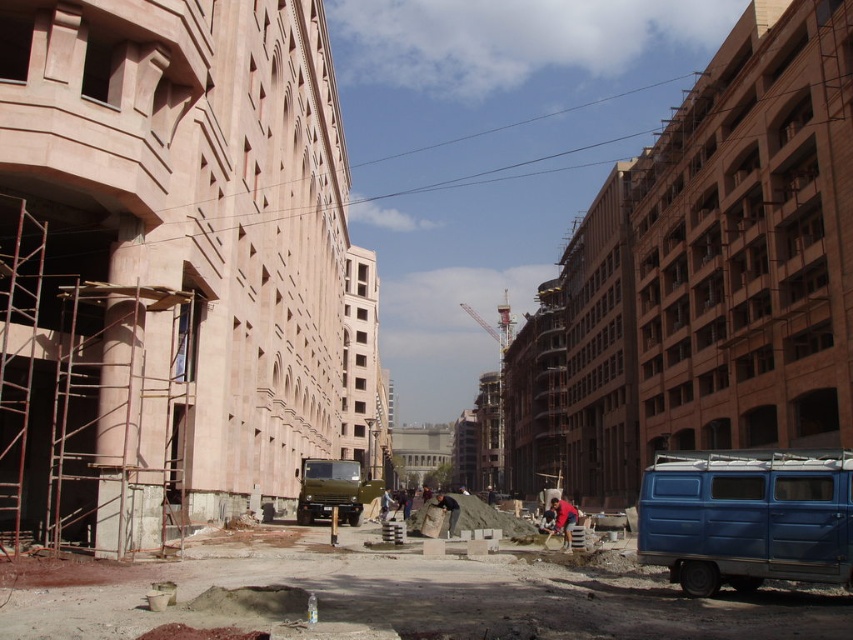
Describe the element at coordinates (747, 516) in the screenshot. I see `blue matte van at lower right` at that location.

Can you confirm if blue matte van at lower right is positioned below red shirt at center?

Actually, blue matte van at lower right is above red shirt at center.

Does point (737, 545) lie in front of point (570, 524)?

Yes, it is in front of point (570, 524).

At what (x,y) coordinates should I click in order to perform the action: click on blue matte van at lower right. Please return your answer as a coordinate pair (x, y). This screenshot has width=853, height=640. Looking at the image, I should click on (747, 516).